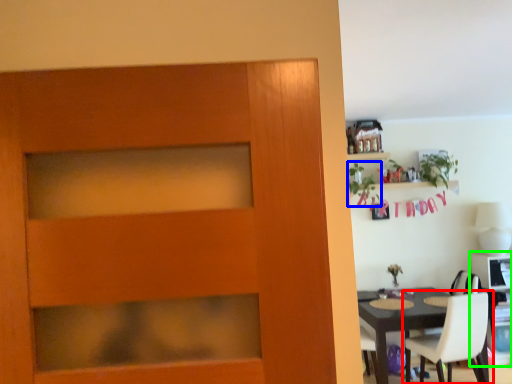
Question: Which is nearer to the chair (highlighted by a red box)? plant (highlighted by a blue box) or computer desk (highlighted by a green box).

Choices:
 (A) plant
 (B) computer desk

Answer: (B)